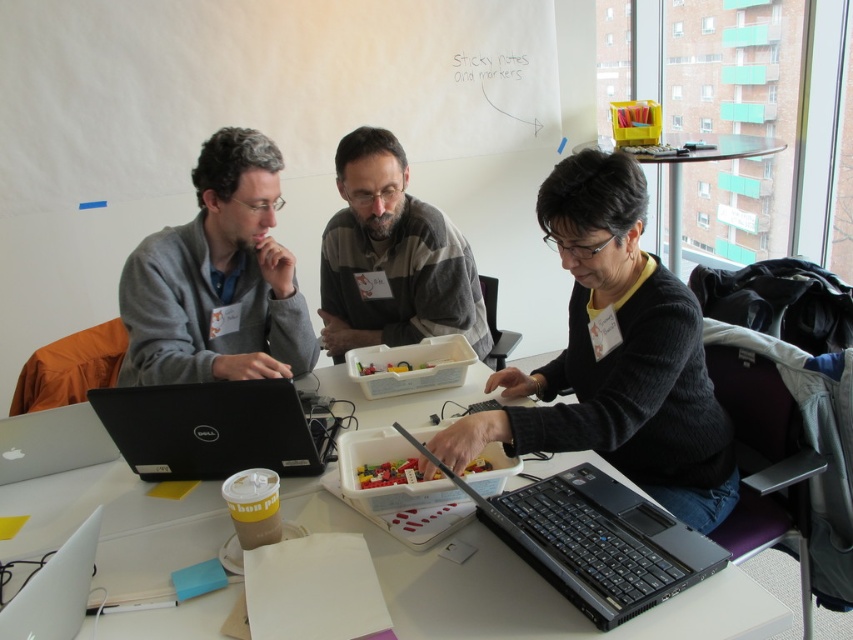
You are organizing a workshop and need to place two black matte laptops on a table. The laptops are labeled as the black matte laptop at center and the black matte laptop at left. Given their sizes, which one would you choose to place on a smaller shelf?

The black matte laptop at center occupies less space than the black matte laptop at left, so you should place the black matte laptop at center on the smaller shelf.